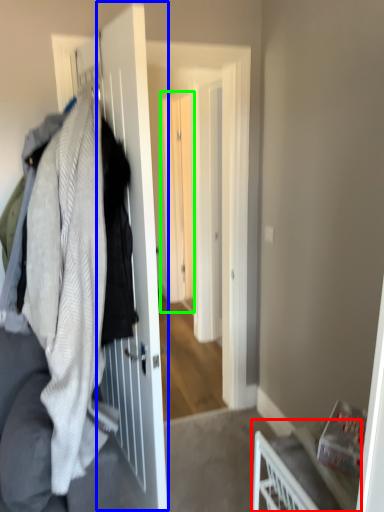
Question: Based on their relative distances, which object is nearer to furniture (highlighted by a red box)? Choose from screen door (highlighted by a blue box) and screen door (highlighted by a green box).

Choices:
 (A) screen door
 (B) screen door

Answer: (A)